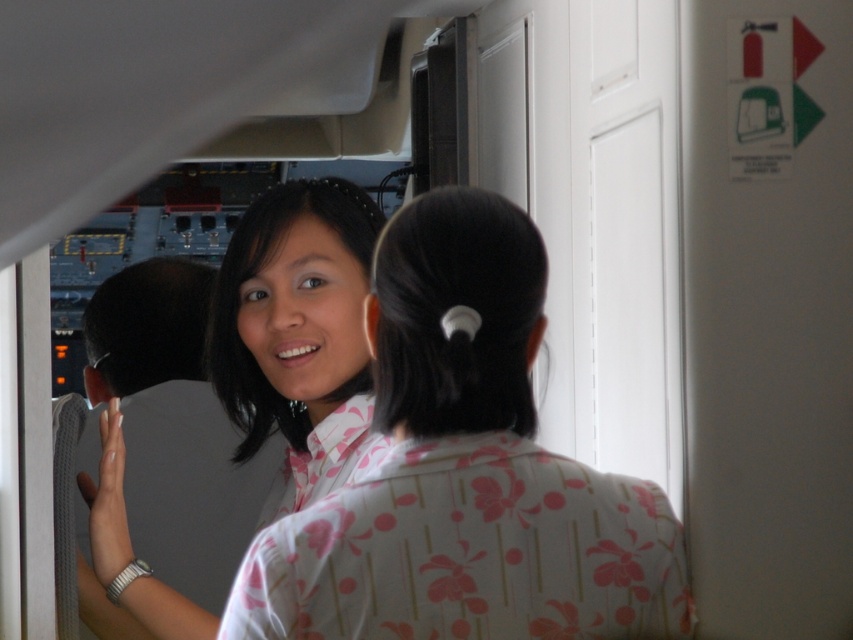
In the scene shown: You are a flight attendant checking the visibility of passengers in the aircraft cabin. You notice the pink floral shirt at center and the matte white shirt at center. Which shirt is blocking the view of the other shirt?

The pink floral shirt at center is positioned over the matte white shirt at center, so it is blocking the view of the matte white shirt at center.

You are a flight attendant guiding passengers to their seats. You see the pink floral shirt at center and the matte white shirt at center in the cabin. Which passenger should you direct first if you need to address the one closer to the aisle?

The matte white shirt at center is closer to the aisle because the pink floral shirt at center is to the right of it, meaning the matte white shirt at center is positioned more towards the aisle side.

You are a tour guide leading a group through an aircraft cabin. You need to ensure that all visitors maintain a minimum distance of 3 meters between each other for safety. Are the two people wearing the pink floral shirt at center and the matte white shirt at center complying with the safety distance requirement?

The pink floral shirt at center is 3.26 meters away from the matte white shirt at center, which exceeds the required 3 meters minimum distance. Therefore, they are complying with the safety distance requirement.